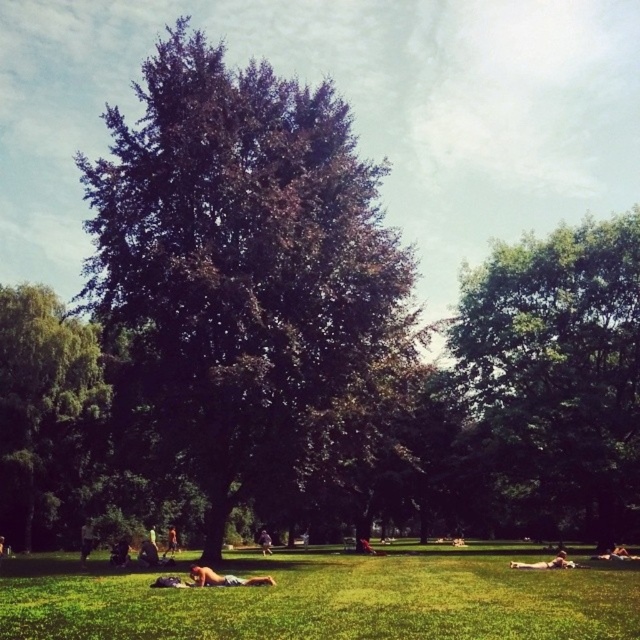
Question: Which object is positioned closest to the light brown grass at lower center?

Choices:
 (A) brown leather jacket at center
 (B) light brown fabric shirt at lower left
 (C) leather jacket at center

Answer: (B)

Question: Does light brown skin at lower right appear on the left side of brown leather jacket at lower left?

Choices:
 (A) yes
 (B) no

Answer: (B)

Question: Can you confirm if green grass at center is positioned below green leafy tree at right?

Choices:
 (A) yes
 (B) no

Answer: (A)

Question: Where is dark brown leather jacket at lower left located in relation to brown leather jacket at lower left in the image?

Choices:
 (A) above
 (B) below

Answer: (A)

Question: Which point is farther to the camera?

Choices:
 (A) (3, 305)
 (B) (531, 579)
 (C) (92, 522)

Answer: (C)

Question: Among these objects, which one is nearest to the camera?

Choices:
 (A) dark brown leather jacket at lower left
 (B) green grass at center
 (C) green leafy tree at left
 (D) green leafy tree at right

Answer: (B)